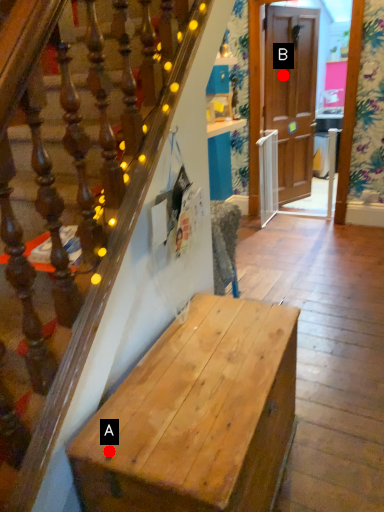
Question: Two points are circled on the image, labeled by A and B beside each circle. Which point is farther to the camera?

Choices:
 (A) A is further
 (B) B is further

Answer: (B)